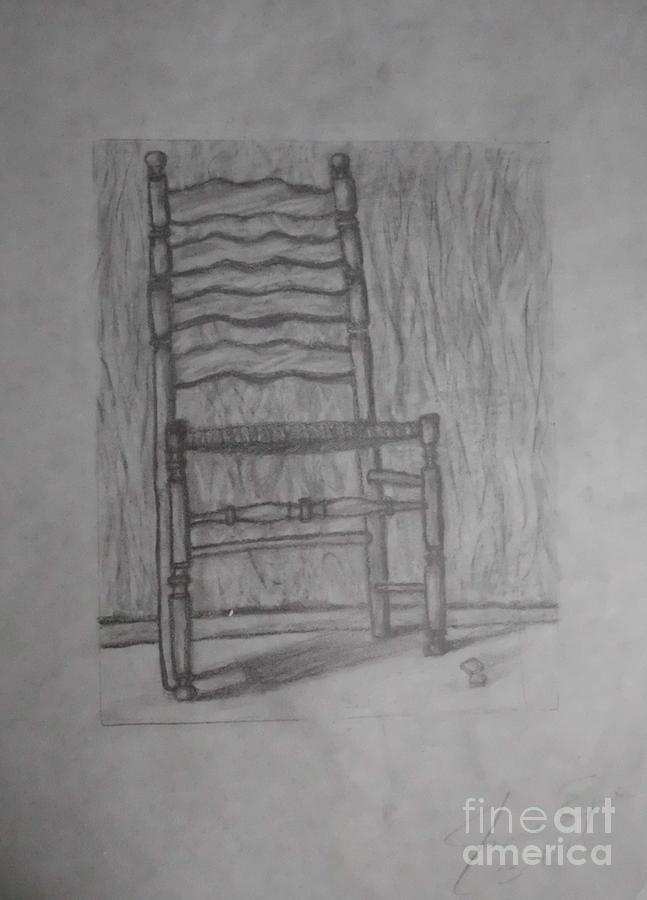
In order to click on cut design on supportive underneath crossbeam of chair in this screenshot , I will do `click(305, 508)`.